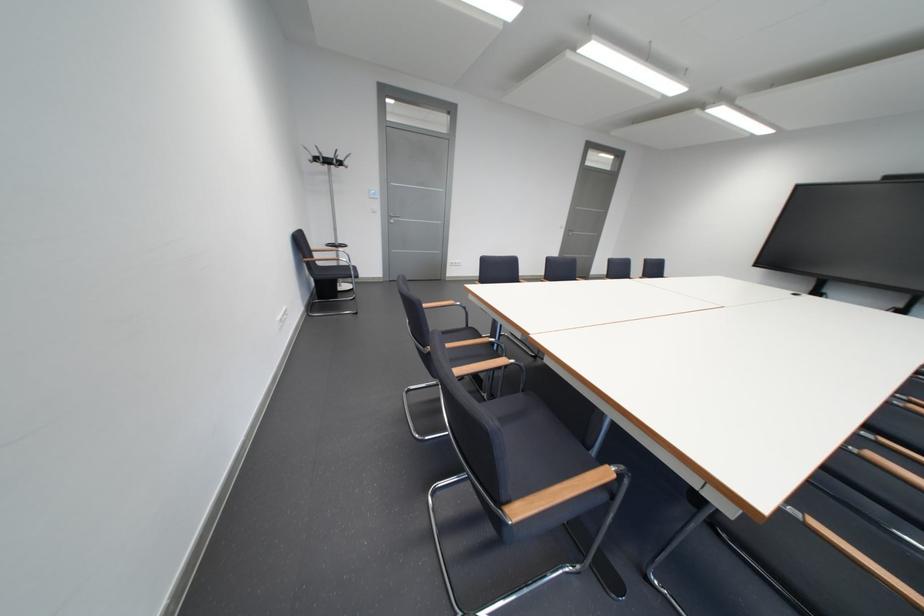
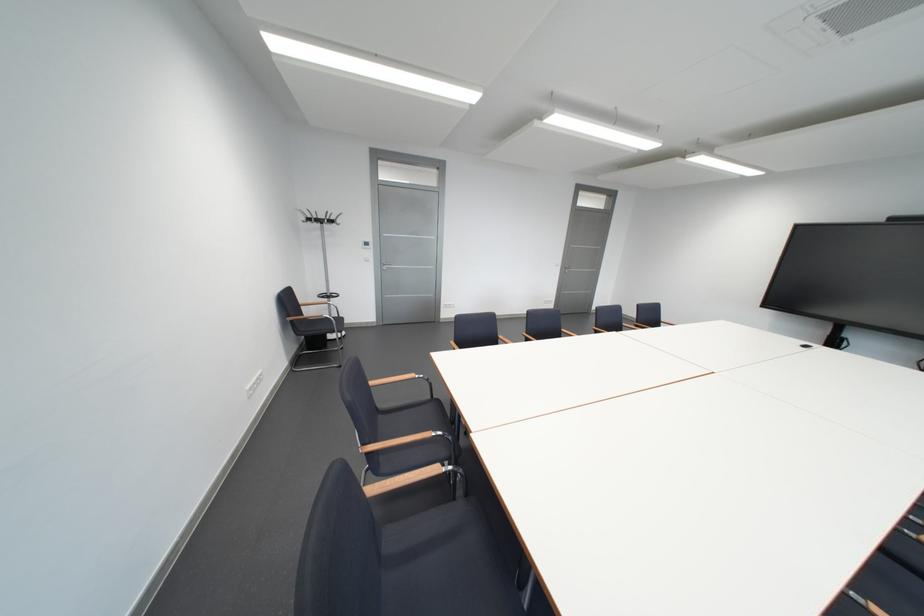
Question: In a continuous first-person perspective shot, in which direction is the camera moving?

Choices:
 (A) Left
 (B) Right
 (C) Forward
 (D) Backward

Answer: (B)